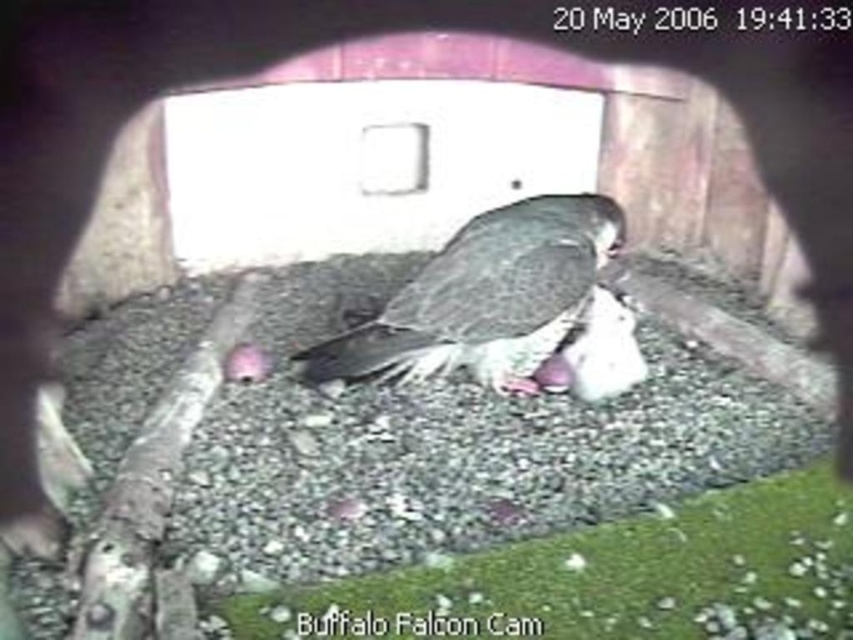
Question: Which point appears closest to the camera in this image?

Choices:
 (A) (549, 275)
 (B) (428, 500)

Answer: (B)

Question: In this image, where is gray gravel at center located relative to dark gray feathers at center?

Choices:
 (A) below
 (B) above

Answer: (A)

Question: Does gray gravel at center have a greater width compared to dark gray feathers at center?

Choices:
 (A) no
 (B) yes

Answer: (B)

Question: Which object is closer to the camera taking this photo?

Choices:
 (A) dark gray feathers at center
 (B) gray gravel at center

Answer: (B)

Question: Is gray gravel at center further to camera compared to dark gray feathers at center?

Choices:
 (A) no
 (B) yes

Answer: (A)

Question: Which object is closer to the camera taking this photo?

Choices:
 (A) dark gray feathers at center
 (B) gray gravel at center

Answer: (B)